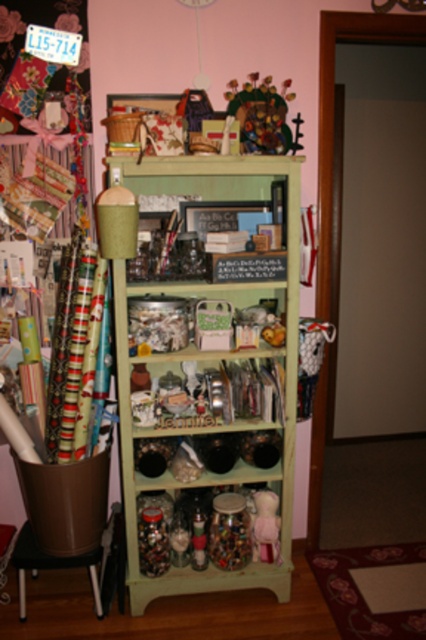
Question: Where is green painted wood bookshelf at center located in relation to brown plastic stool at lower left in the image?

Choices:
 (A) left
 (B) right

Answer: (B)

Question: Does green painted wood bookshelf at center have a smaller size compared to brown plastic stool at lower left?

Choices:
 (A) yes
 (B) no

Answer: (B)

Question: Which of the following is the closest to the observer?

Choices:
 (A) (233, 378)
 (B) (28, 529)

Answer: (A)

Question: Can you confirm if green painted wood bookshelf at center is bigger than brown plastic stool at lower left?

Choices:
 (A) no
 (B) yes

Answer: (B)